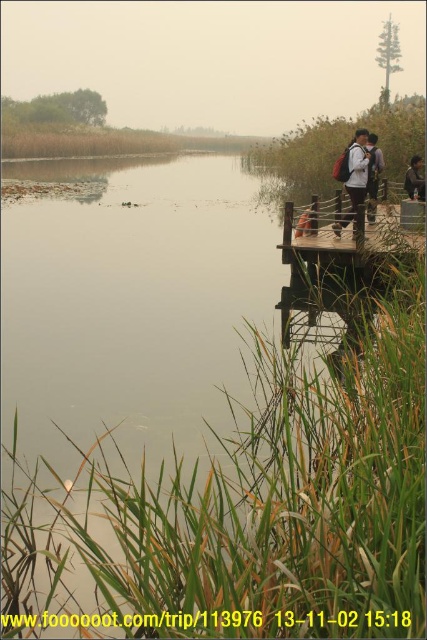
Who is taller, wooden dock at center or matte brown backpack at upper right?

With more height is matte brown backpack at upper right.

Is wooden dock at center to the right of matte brown backpack at upper right from the viewer's perspective?

Incorrect, wooden dock at center is not on the right side of matte brown backpack at upper right.

Which is behind, point (374, 248) or point (374, 150)?

Point (374, 150)

Identify the location of wooden dock at center. (345, 234).

In the scene shown: Is matte brown backpack at upper right smaller than matte black backpack at upper right?

No, matte brown backpack at upper right is not smaller than matte black backpack at upper right.

Between matte brown backpack at upper right and matte black backpack at upper right, which one appears on the right side from the viewer's perspective?

Positioned to the right is matte black backpack at upper right.

Is point (371, 145) positioned behind point (412, 164)?

No, (371, 145) is in front of (412, 164).

At what (x,y) coordinates should I click in order to perform the action: click on matte brown backpack at upper right. Please return your answer as a coordinate pair (x, y). Looking at the image, I should click on (373, 173).

Is wooden dock at center taller than matte black backpack at upper right?

Yes.

Is point (286, 236) closer to viewer compared to point (420, 179)?

Yes, it is in front of point (420, 179).

The width and height of the screenshot is (427, 640). I want to click on wooden dock at center, so click(345, 234).